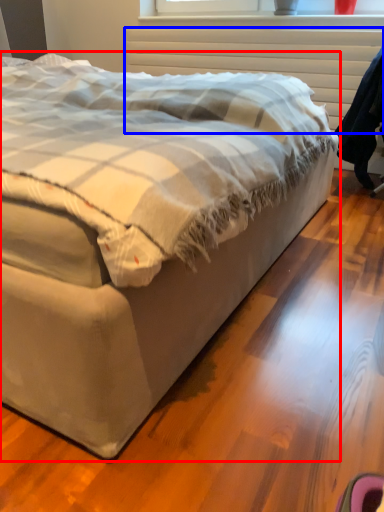
Question: Which object appears closest to the camera in this image, bed (highlighted by a red box) or radiator (highlighted by a blue box)?

Choices:
 (A) bed
 (B) radiator

Answer: (A)